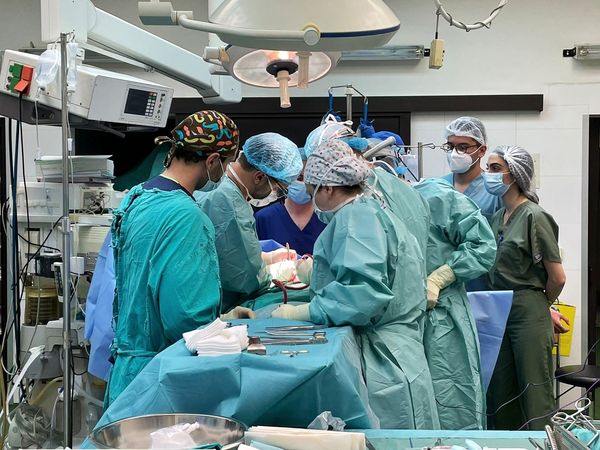
The height and width of the screenshot is (450, 600). Identify the location of metal bowl. (142, 426).